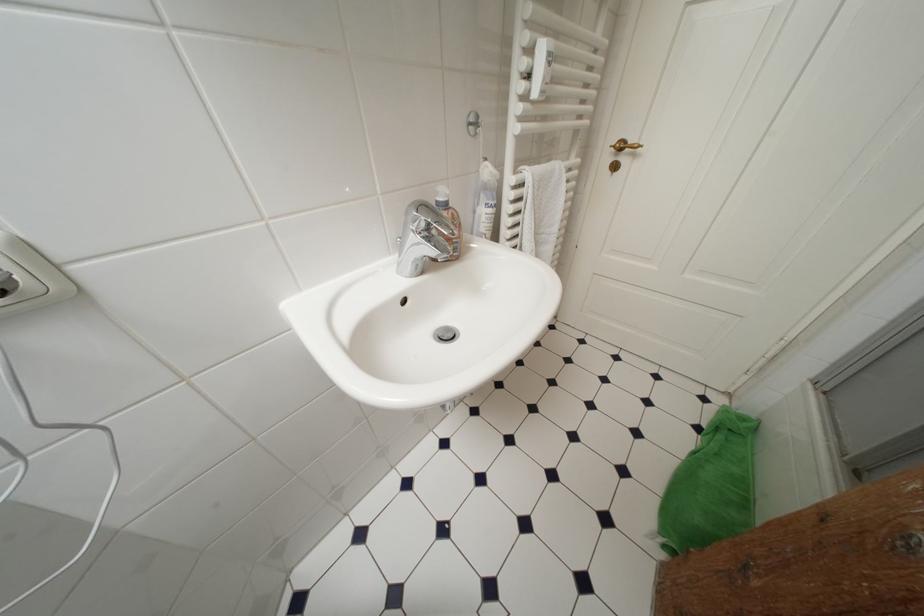
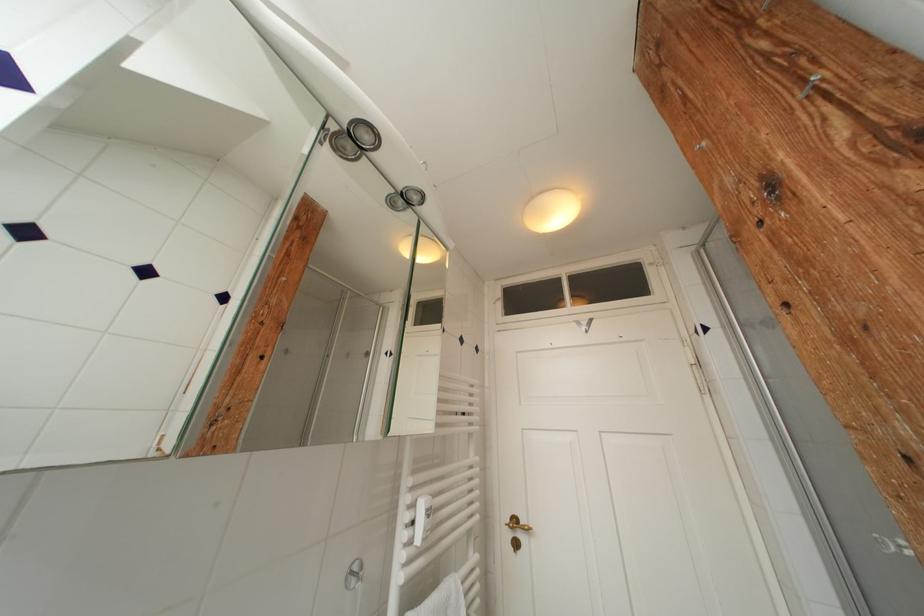
The point at (627, 148) is marked in the first image. Where is the corresponding point in the second image?

(521, 525)